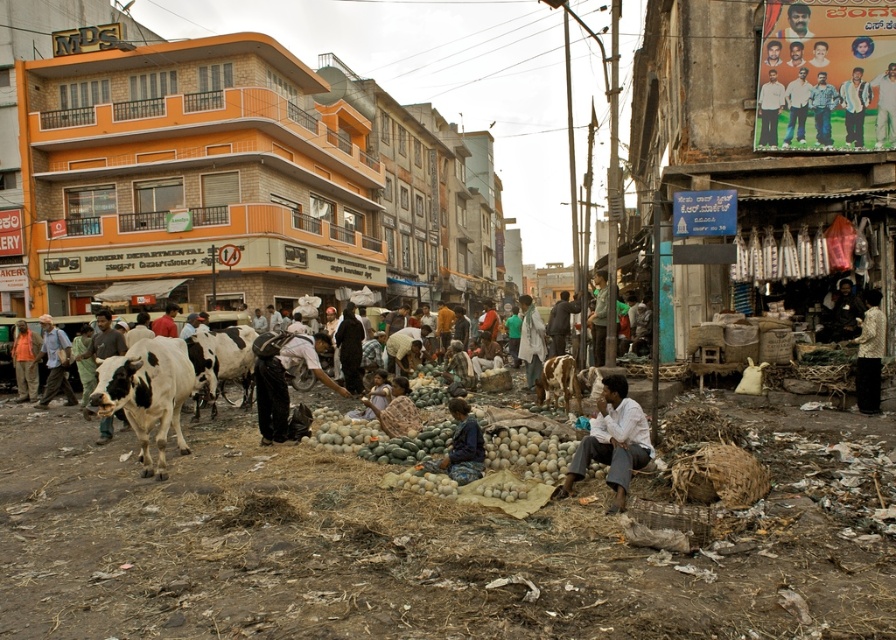
Question: Is black fabric bag at center smaller than denim shirt at upper right?

Choices:
 (A) yes
 (B) no

Answer: (B)

Question: Estimate the real-world distances between objects in this image. Which object is closer to the white shirt at upper right?

Choices:
 (A) light brown wooden signboard at upper right
 (B) white cotton shirt at center
 (C) white glossy cow at lower left

Answer: (A)

Question: Considering the relative positions of white glossy cow at center and light blue shirt at upper right in the image provided, where is white glossy cow at center located with respect to light blue shirt at upper right?

Choices:
 (A) above
 (B) below

Answer: (B)

Question: Does black fabric bag at center lie in front of dark blue shirt at center?

Choices:
 (A) no
 (B) yes

Answer: (B)

Question: Among these objects, which one is farthest from the camera?

Choices:
 (A) black fabric bag at center
 (B) white shirt at center

Answer: (B)

Question: Estimate the real-world distances between objects in this image. Which object is closer to the white shirt at upper right?

Choices:
 (A) black fabric bag at center
 (B) white glossy cow at lower left

Answer: (A)